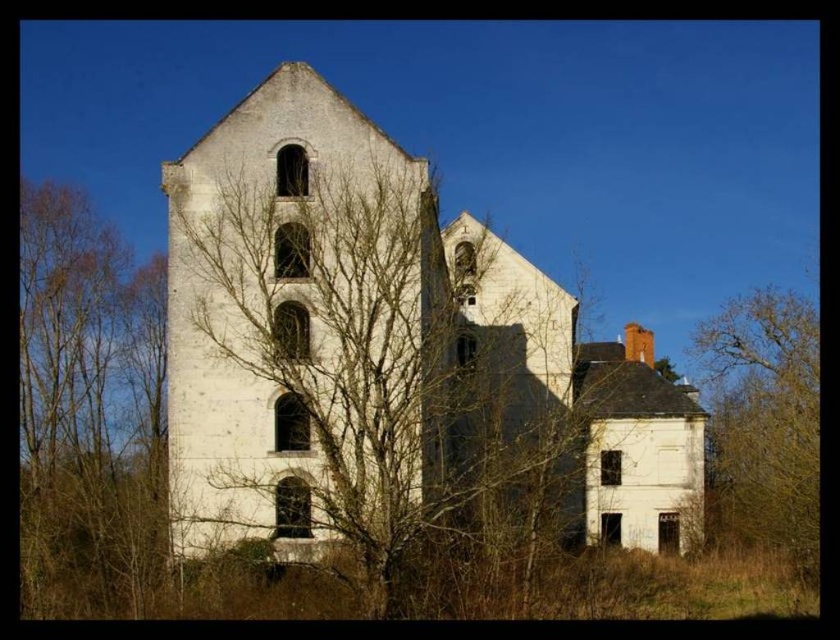
Is white stone church at center further to camera compared to bare branches at left?

No, white stone church at center is closer to the viewer.

How far apart are white stone church at center and bare branches at left?

They are 24.14 meters apart.

Where is `white stone church at center`? The height and width of the screenshot is (640, 840). white stone church at center is located at coordinates (386, 353).

Which is above, bare branches at left or yellow-green leafy tree at right?

bare branches at left

Is bare branches at left taller than yellow-green leafy tree at right?

Yes, bare branches at left is taller than yellow-green leafy tree at right.

Who is more distant from viewer, (114,260) or (770,337)?

Positioned behind is point (770,337).

The width and height of the screenshot is (840, 640). Find the location of `bare branches at left`. bare branches at left is located at coordinates (88, 406).

Is white stone church at center positioned before yellow-green leafy tree at right?

That is True.

Between white stone church at center and yellow-green leafy tree at right, which one appears on the left side from the viewer's perspective?

Positioned to the left is white stone church at center.

In order to click on white stone church at center in this screenshot , I will do `click(386, 353)`.

You are a GUI agent. You are given a task and a screenshot of the screen. Output one action in this format:
    pyautogui.click(x=<x>, y=<y>)
    Task: Click on the white stone church at center
    
    Given the screenshot: What is the action you would take?
    (x=386, y=353)